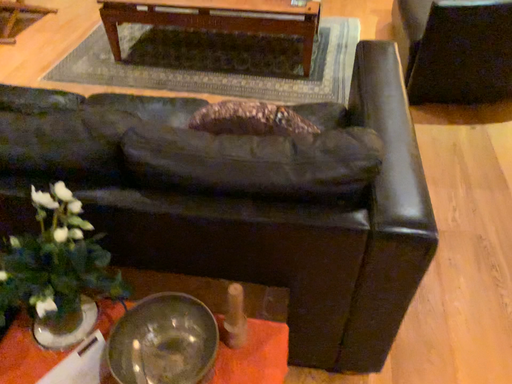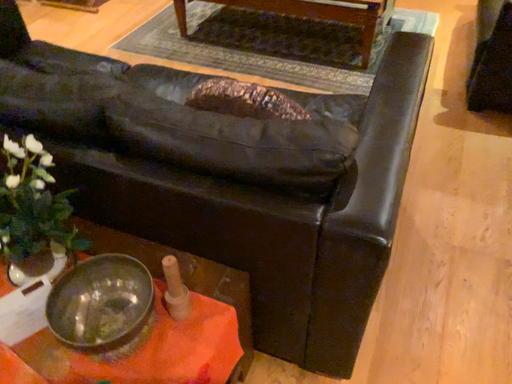
Question: How did the camera likely rotate when shooting the video?

Choices:
 (A) rotated right
 (B) rotated left

Answer: (B)